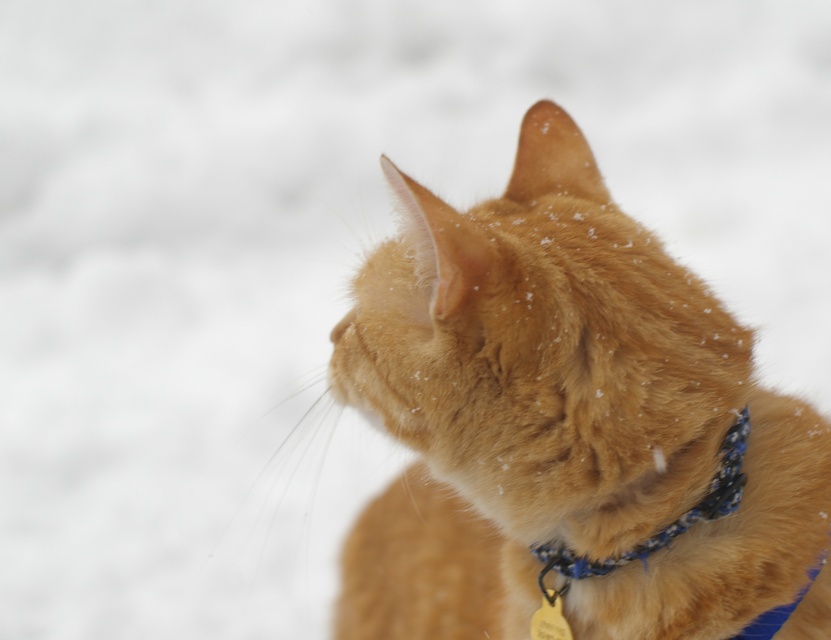
You are a veterinarian examining an image of an orange tabby cat in a snowy area. The cat has a blue fabric neckband. Based on the image, can you determine if the blue fabric neckband at center is attached to the orange fur cat at center?

The blue fabric neckband at center is 11.81 inches away from the orange fur cat at center, so it is not attached to the cat.

You are a photographer trying to capture a close shot of the orange fur cat at center. The blue fabric neckband at center is partially blocking the view. Can you estimate if the cat is wider than the neckband to decide if moving the collar would be necessary?

The orange fur cat at center might be wider than blue fabric neckband at center, so moving the collar might be necessary to ensure the entire cat is visible in the photo.